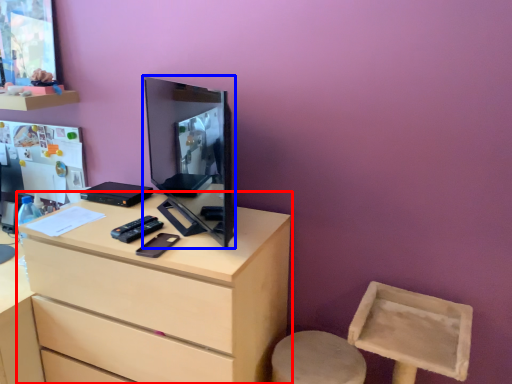
Question: Among these objects, which one is farthest to the camera, chest of drawers (highlighted by a red box) or computer monitor (highlighted by a blue box)?

Choices:
 (A) chest of drawers
 (B) computer monitor

Answer: (A)